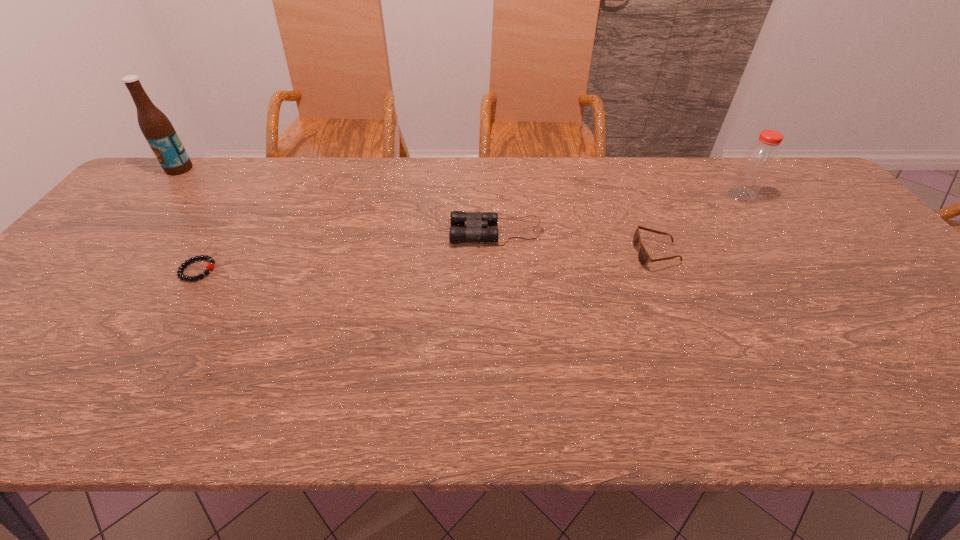
Where is `vacant area that lies between the tallest object and the third object from right to left`? vacant area that lies between the tallest object and the third object from right to left is located at coordinates (338, 200).

Find the location of a particular element. The image size is (960, 540). vacant area that lies between the third object from left to right and the leftmost object is located at coordinates (338, 200).

You are a GUI agent. You are given a task and a screenshot of the screen. Output one action in this format:
    pyautogui.click(x=<x>, y=<y>)
    Task: Click on the vacant area that lies between the leftmost object and the sunglasses
    This screenshot has height=540, width=960.
    Given the screenshot: What is the action you would take?
    pyautogui.click(x=418, y=211)

Where is `empty space between the fourth nearest object and the binoculars`? empty space between the fourth nearest object and the binoculars is located at coordinates (619, 214).

Where is `unoccupied position between the bottle and the tallest object`? This screenshot has height=540, width=960. unoccupied position between the bottle and the tallest object is located at coordinates (461, 182).

Identify the location of object that stands as the fourth closest to the sunglasses. The height and width of the screenshot is (540, 960). (157, 129).

Locate an element on the screen. the second closest object to the second object from right to left is located at coordinates (759, 161).

Where is `free spot that satisfies the following two spatial constraints: 1. on the front side of the beer bottle; 2. on the right side of the second farthest object`? This screenshot has height=540, width=960. free spot that satisfies the following two spatial constraints: 1. on the front side of the beer bottle; 2. on the right side of the second farthest object is located at coordinates (156, 195).

Find the location of `free spot that satisfies the following two spatial constraints: 1. on the front side of the rightmost object; 2. at the eyepiece of the third object from left to right`. free spot that satisfies the following two spatial constraints: 1. on the front side of the rightmost object; 2. at the eyepiece of the third object from left to right is located at coordinates (768, 232).